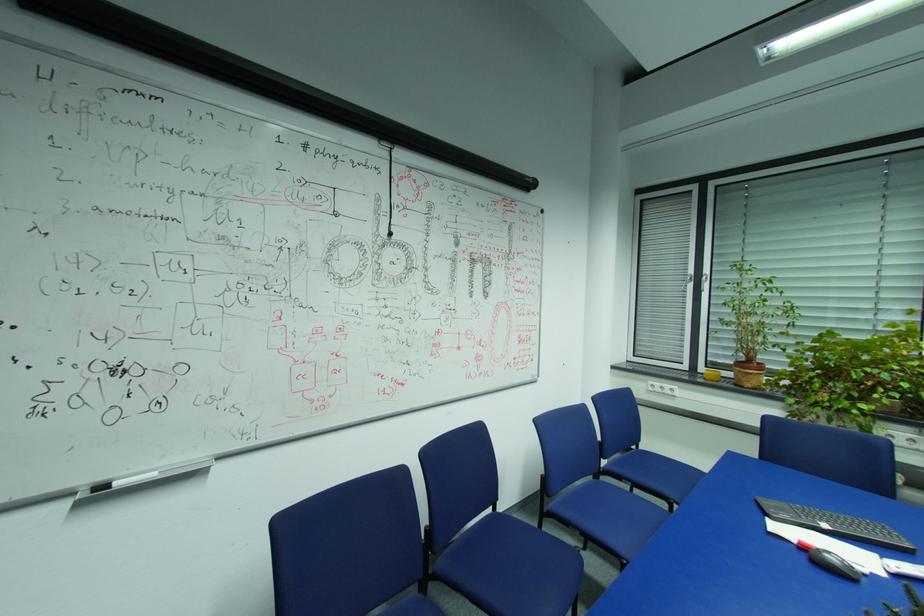
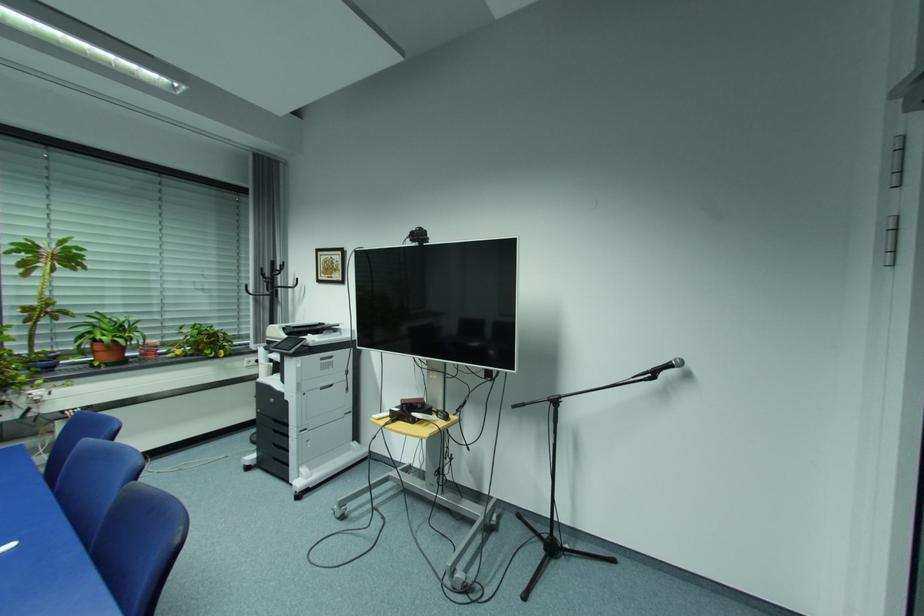
Question: The camera is either moving clockwise (left) or counter-clockwise (right) around the object. The first image is from the beginning of the video and the second image is from the end. Is the camera moving left or right when shooting the video?

Choices:
 (A) Left
 (B) Right

Answer: (A)